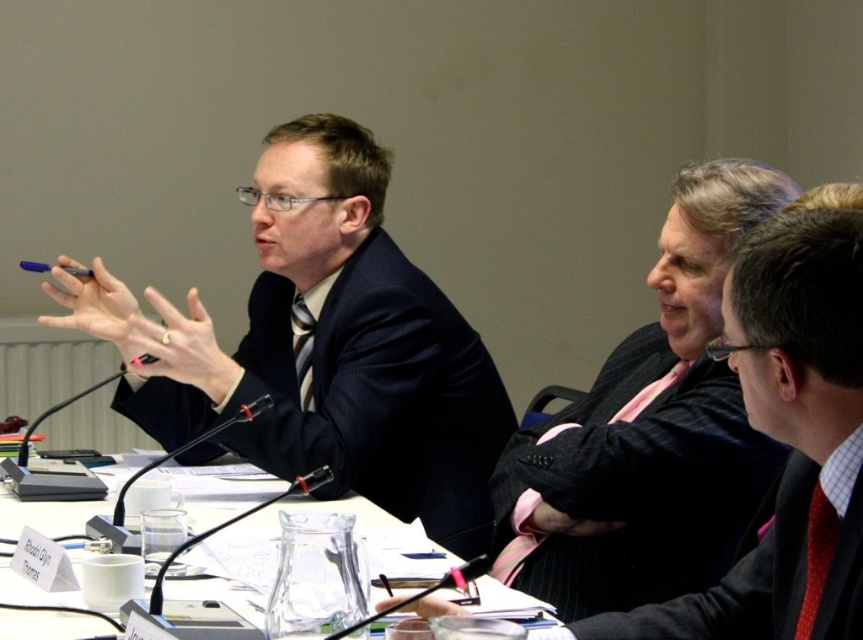
You are a photographer setting up for a group photo. You need to position the matte black suit at left and the clear glass table at center in a way that the suit is not obstructing the table. Is the current arrangement suitable for this requirement?

The matte black suit at left is positioned over clear glass table at center, so the current arrangement is not suitable because the suit is obstructing the table.

You are a photographer taking a picture of the meeting participants. You need to ensure that both the matte black suit at left and the black pinstripe suit at right are clearly visible in the photo. Based on their positions, which suit is positioned higher in the frame?

The matte black suit at left is located above the black pinstripe suit at right, so it is positioned higher in the frame.